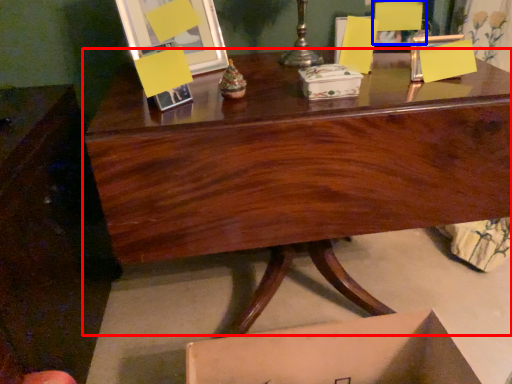
Question: Which object is further to the camera taking this photo, desk (highlighted by a red box) or armchair (highlighted by a blue box)?

Choices:
 (A) desk
 (B) armchair

Answer: (B)